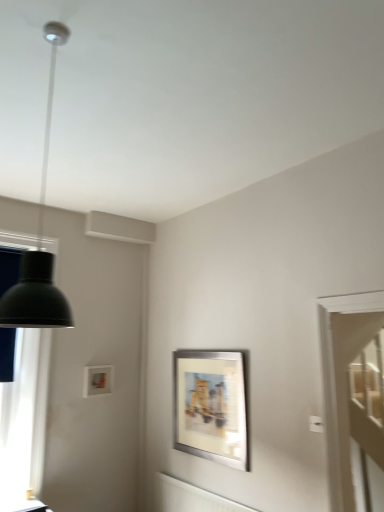
The image size is (384, 512). Describe the element at coordinates (23, 506) in the screenshot. I see `matte black table at lower left` at that location.

At what (x,y) coordinates should I click in order to perform the action: click on silver metallic picture frame at center, acting as the second picture frame starting from the left. Please return your answer as a coordinate pair (x, y). The width and height of the screenshot is (384, 512). Looking at the image, I should click on (210, 406).

Describe the element at coordinates (210, 406) in the screenshot. Image resolution: width=384 pixels, height=512 pixels. I see `silver metallic picture frame at center, the 1th picture frame viewed from the front` at that location.

Where is `transparent glass door at right`? transparent glass door at right is located at coordinates (359, 407).

Locate an element on the screen. matte black lampshade at left is located at coordinates (25, 415).

Could silver metallic picture frame at center, the first picture frame in the right-to-left sequence, be considered to be inside matte black table at lower left?

No, silver metallic picture frame at center, the first picture frame in the right-to-left sequence, is not surrounded by matte black table at lower left.

How much distance is there between matte black table at lower left and silver metallic picture frame at center, positioned as the 2th picture frame in back-to-front order?

matte black table at lower left is 1.36 meters from silver metallic picture frame at center, positioned as the 2th picture frame in back-to-front order.

Which object is wider, matte black table at lower left or silver metallic picture frame at center, positioned as the 2th picture frame in back-to-front order?

matte black table at lower left is wider.

Between matte black table at lower left and silver metallic picture frame at center, the first picture frame in the right-to-left sequence, which one is positioned behind?

silver metallic picture frame at center, the first picture frame in the right-to-left sequence, is behind.

At what (x,y) coordinates should I click in order to perform the action: click on the 2nd picture frame positioned below the matte black lampshade at left (from the image's perspective). Please return your answer as a coordinate pair (x, y). Looking at the image, I should click on (210, 406).

How different are the orientations of matte black lampshade at left and silver metallic picture frame at center, the first picture frame in the right-to-left sequence, in degrees?

There is a 88.8-degree angle between the facing directions of matte black lampshade at left and silver metallic picture frame at center, the first picture frame in the right-to-left sequence.

Based on the photo, can you confirm if matte black lampshade at left is positioned to the left of silver metallic picture frame at center, positioned as the 2th picture frame in back-to-front order?

Yes.

Can you confirm if matte black lampshade at left is bigger than silver metallic picture frame at center, the first picture frame in the right-to-left sequence?

Yes, matte black lampshade at left is bigger than silver metallic picture frame at center, the first picture frame in the right-to-left sequence.

Looking at this image, from the image's perspective, which is below, matte black lampshade at left or transparent glass door at right?

transparent glass door at right is shown below in the image.

In the image, there is a matte black lampshade at left. Where is `glass door below it (from the image's perspective)`? Image resolution: width=384 pixels, height=512 pixels. glass door below it (from the image's perspective) is located at coordinates (359, 407).

Is matte black lampshade at left outside of transparent glass door at right?

matte black lampshade at left is positioned outside transparent glass door at right.

Considering the positions of objects matte black lampshade at left and transparent glass door at right in the image provided, who is in front, matte black lampshade at left or transparent glass door at right?

transparent glass door at right is closer to the camera.

Is transparent glass door at right not inside black matte lamp at left?

Absolutely, transparent glass door at right is external to black matte lamp at left.

Measure the distance between transparent glass door at right and black matte lamp at left.

transparent glass door at right is 9.30 feet from black matte lamp at left.

From a real-world perspective, is transparent glass door at right physically above black matte lamp at left?

No, from a real-world perspective, transparent glass door at right is not above black matte lamp at left.

Is black matte lamp at left closer to camera compared to matte black lampshade at left?

Yes.

From the image's perspective, between black matte lamp at left and matte black lampshade at left, which one is located above?

From the image's view, black matte lamp at left is above.

Considering the positions of points (34, 291) and (0, 424), is point (34, 291) closer to camera compared to point (0, 424)?

Yes.

From a real-world perspective, relative to matte black lampshade at left, is black matte lamp at left vertically above or below?

Clearly, from a real-world perspective, black matte lamp at left is above matte black lampshade at left.

Is black matte lamp at left closer to the viewer compared to matte white picture frame at upper left, which ranks as the second picture frame in right-to-left order?

Yes, it is in front of matte white picture frame at upper left, which ranks as the second picture frame in right-to-left order.

From the image's perspective, is black matte lamp at left beneath matte white picture frame at upper left, which ranks as the second picture frame in right-to-left order?

No, from the image's perspective, black matte lamp at left is not below matte white picture frame at upper left, which ranks as the second picture frame in right-to-left order.

Consider the image. Does black matte lamp at left have a lesser width compared to matte white picture frame at upper left, marked as the 1th picture frame in a back-to-front arrangement?

No, black matte lamp at left is not thinner than matte white picture frame at upper left, marked as the 1th picture frame in a back-to-front arrangement.

Is black matte lamp at left positioned far away from matte white picture frame at upper left, marked as the 1th picture frame in a back-to-front arrangement?

Indeed, black matte lamp at left is not near matte white picture frame at upper left, marked as the 1th picture frame in a back-to-front arrangement.

Is point (40, 486) closer or farther from the camera than point (88, 395)?

Point (40, 486) is positioned closer to the camera compared to point (88, 395).

From a real-world perspective, does matte black lampshade at left sit lower than matte white picture frame at upper left, which is counted as the second picture frame, starting from the front?

Incorrect, from a real-world perspective, matte black lampshade at left is higher than matte white picture frame at upper left, which is counted as the second picture frame, starting from the front.

Does matte black lampshade at left turn towards matte white picture frame at upper left, which ranks as the second picture frame in right-to-left order?

No.

The width and height of the screenshot is (384, 512). In order to click on table that appears on the left of silver metallic picture frame at center, acting as the second picture frame starting from the left in this screenshot , I will do [x=23, y=506].

Locate an element on the screen. The image size is (384, 512). window above the silver metallic picture frame at center, the 1th picture frame viewed from the front (from the image's perspective) is located at coordinates [x=25, y=415].

Estimate the real-world distances between objects in this image. Which object is further from matte white picture frame at upper left, which ranks as the first picture frame in left-to-right order, matte black table at lower left or black matte lamp at left?

Among the two, black matte lamp at left is located further to matte white picture frame at upper left, which ranks as the first picture frame in left-to-right order.

When comparing their distances from matte white picture frame at upper left, which is counted as the second picture frame, starting from the front, does matte black table at lower left or matte black lampshade at left seem closer?

matte black lampshade at left.

Based on their spatial positions, is matte black table at lower left or transparent glass door at right closer to black matte lamp at left?

The object closer to black matte lamp at left is matte black table at lower left.

Estimate the real-world distances between objects in this image. Which object is closer to transparent glass door at right, matte white picture frame at upper left, which ranks as the second picture frame in right-to-left order, or matte black lampshade at left?

matte white picture frame at upper left, which ranks as the second picture frame in right-to-left order.

Considering their positions, is matte black lampshade at left positioned further to matte black table at lower left than matte white picture frame at upper left, which ranks as the first picture frame in left-to-right order?

The object further to matte black table at lower left is matte white picture frame at upper left, which ranks as the first picture frame in left-to-right order.

Estimate the real-world distances between objects in this image. Which object is further from matte black table at lower left, silver metallic picture frame at center, the 1th picture frame viewed from the front, or matte black lampshade at left?

silver metallic picture frame at center, the 1th picture frame viewed from the front, is further to matte black table at lower left.

When comparing their distances from matte black lampshade at left, does transparent glass door at right or matte black table at lower left seem further?

transparent glass door at right is further to matte black lampshade at left.

From the image, which object appears to be nearer to matte white picture frame at upper left, which ranks as the second picture frame in right-to-left order, black matte lamp at left or transparent glass door at right?

Among the two, black matte lamp at left is located nearer to matte white picture frame at upper left, which ranks as the second picture frame in right-to-left order.

You are a GUI agent. You are given a task and a screenshot of the screen. Output one action in this format:
    pyautogui.click(x=<x>, y=<y>)
    Task: Click on the picture frame between matte black lampshade at left and silver metallic picture frame at center, acting as the second picture frame starting from the left, from left to right
    Image resolution: width=384 pixels, height=512 pixels.
    Given the screenshot: What is the action you would take?
    pyautogui.click(x=97, y=380)

This screenshot has height=512, width=384. In order to click on picture frame located between matte black table at lower left and silver metallic picture frame at center, the 1th picture frame viewed from the front, in the left-right direction in this screenshot , I will do `click(97, 380)`.

Locate an element on the screen. The image size is (384, 512). picture frame between black matte lamp at left and matte white picture frame at upper left, which ranks as the second picture frame in right-to-left order, from front to back is located at coordinates [x=210, y=406].

You are a GUI agent. You are given a task and a screenshot of the screen. Output one action in this format:
    pyautogui.click(x=<x>, y=<y>)
    Task: Click on the picture frame between matte white picture frame at upper left, which ranks as the first picture frame in left-to-right order, and transparent glass door at right from left to right
    Image resolution: width=384 pixels, height=512 pixels.
    Given the screenshot: What is the action you would take?
    pyautogui.click(x=210, y=406)